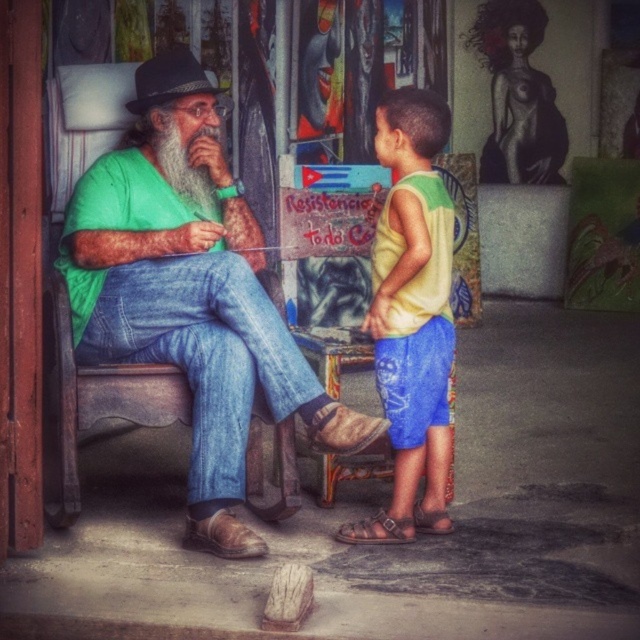
Between green matte shirt at left and yellow-green tank top at center, which one is positioned higher?

green matte shirt at left

Is green matte shirt at left positioned behind yellow-green tank top at center?

No.

In order to click on green matte shirt at left in this screenshot , I will do `click(192, 301)`.

Is point (195, 332) less distant than point (170, 120)?

Yes.

Between green matte shirt at left and graywoollybeard at left, which one has more height?

With more height is green matte shirt at left.

Where is `green matte shirt at left`? This screenshot has width=640, height=640. green matte shirt at left is located at coordinates (192, 301).

Where is `green matte shirt at left`? The image size is (640, 640). green matte shirt at left is located at coordinates (192, 301).

Who is lower down, yellow-green tank top at center or graywoollybeard at left?

yellow-green tank top at center is lower down.

The image size is (640, 640). What are the coordinates of `yellow-green tank top at center` in the screenshot? It's located at (412, 314).

Locate an element on the screen. The width and height of the screenshot is (640, 640). yellow-green tank top at center is located at coordinates point(412,314).